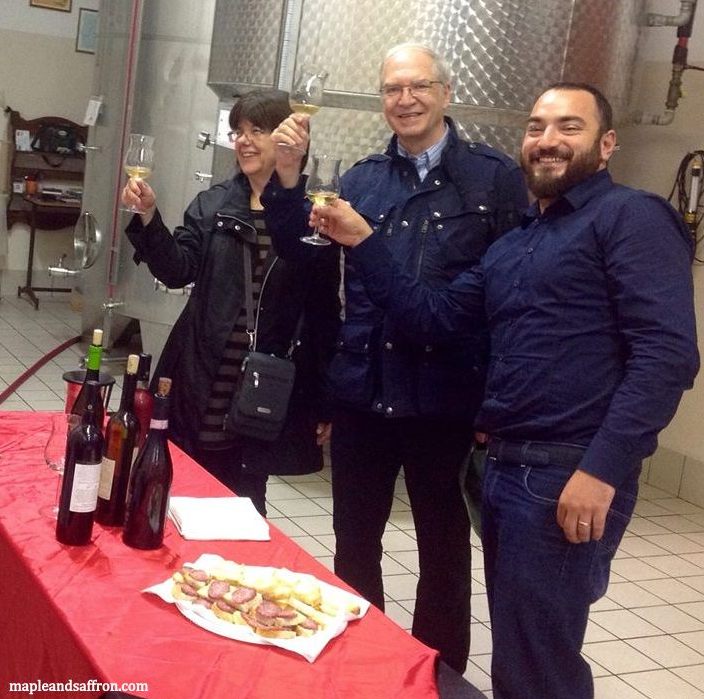
This screenshot has width=704, height=699. In order to click on dark-colored table in this screenshot , I will do `click(448, 683)`.